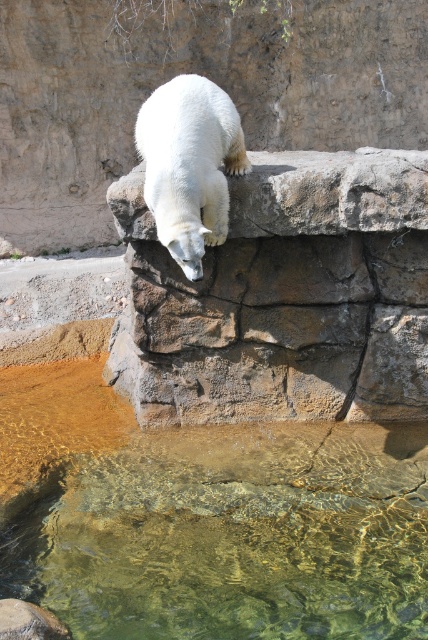
Is point (311, 384) positioned before point (211, 218)?

No, it is behind (211, 218).

Can you confirm if brown rough stone at upper center is smaller than white fur bear at upper center?

No, brown rough stone at upper center is not smaller than white fur bear at upper center.

Describe the element at coordinates (288, 294) in the screenshot. I see `brown rough stone at upper center` at that location.

What are the coordinates of `brown rough stone at upper center` in the screenshot? It's located at (288, 294).

Who is positioned more to the right, clear glass water at lower center or brown rough stone at upper center?

brown rough stone at upper center

Who is more forward, [398,612] or [410,358]?

Point [398,612] is more forward.

Image resolution: width=428 pixels, height=640 pixels. I want to click on clear glass water at lower center, so click(231, 534).

Which of these two, clear glass water at lower center or white fur bear at upper center, stands taller?

Standing taller between the two is white fur bear at upper center.

Does clear glass water at lower center have a larger size compared to white fur bear at upper center?

Indeed, clear glass water at lower center has a larger size compared to white fur bear at upper center.

Is point (401, 621) less distant than point (213, 106)?

Yes, point (401, 621) is closer to viewer.

Where is `clear glass water at lower center`? This screenshot has height=640, width=428. clear glass water at lower center is located at coordinates (231, 534).